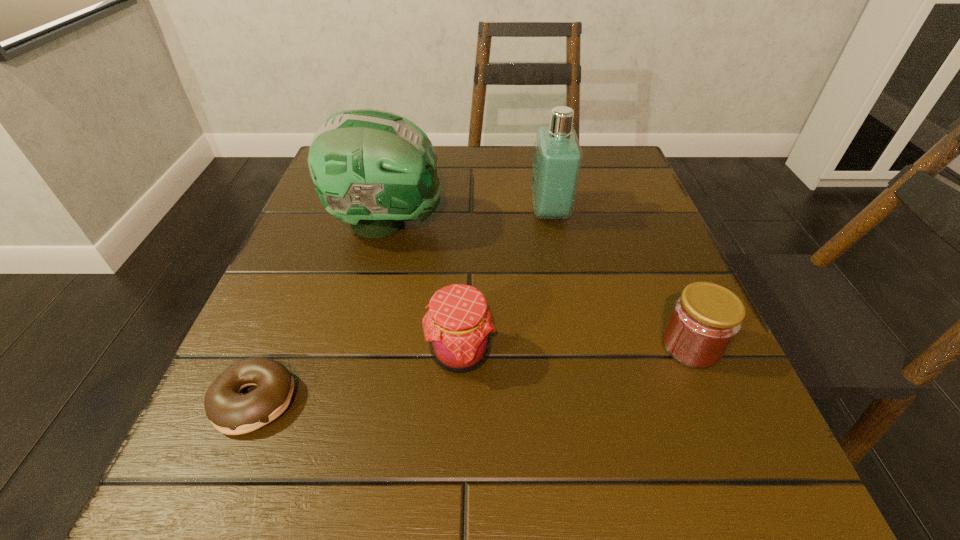
Where is `free location at the left edge of the desktop`? free location at the left edge of the desktop is located at coordinates (348, 248).

Where is `vacant space at the right edge of the desktop`? vacant space at the right edge of the desktop is located at coordinates (598, 251).

This screenshot has height=540, width=960. I want to click on free space at the near left corner of the desktop, so click(287, 453).

Locate an element on the screen. This screenshot has width=960, height=540. free space at the near right corner is located at coordinates (736, 454).

Where is `free space between the football helmet and the rightmost object`? This screenshot has height=540, width=960. free space between the football helmet and the rightmost object is located at coordinates (539, 285).

Locate an element on the screen. The image size is (960, 540). free space between the rightmost object and the left jam is located at coordinates (575, 349).

The width and height of the screenshot is (960, 540). I want to click on vacant area between the football helmet and the perfume, so click(468, 218).

Locate an element on the screen. The height and width of the screenshot is (540, 960). vacant area that lies between the shortest object and the rightmost object is located at coordinates click(x=472, y=373).

Find the location of `free space between the doughnut and the football helmet`. free space between the doughnut and the football helmet is located at coordinates (321, 312).

At what (x,y) coordinates should I click in order to perform the action: click on free point between the rightmost object and the shortest object. Please return your answer as a coordinate pair (x, y). This screenshot has height=540, width=960. Looking at the image, I should click on (472, 373).